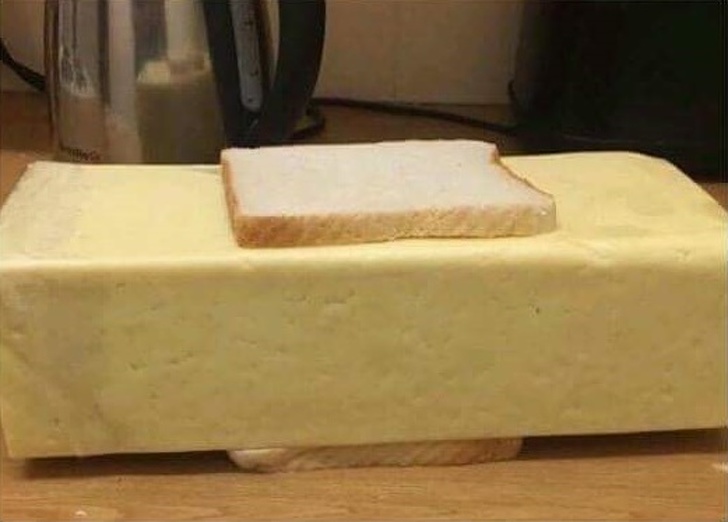
The image size is (728, 522). I want to click on power cord, so click(455, 116).